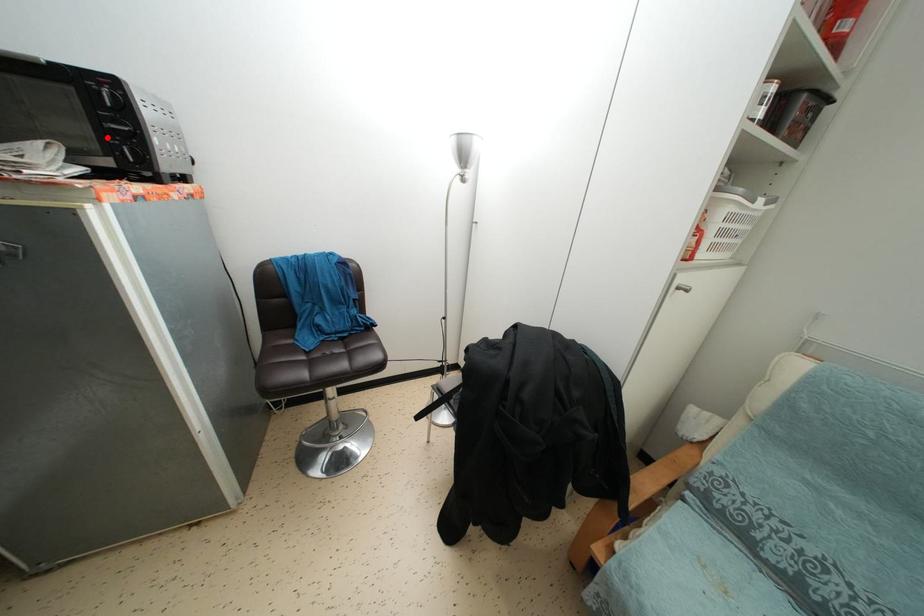
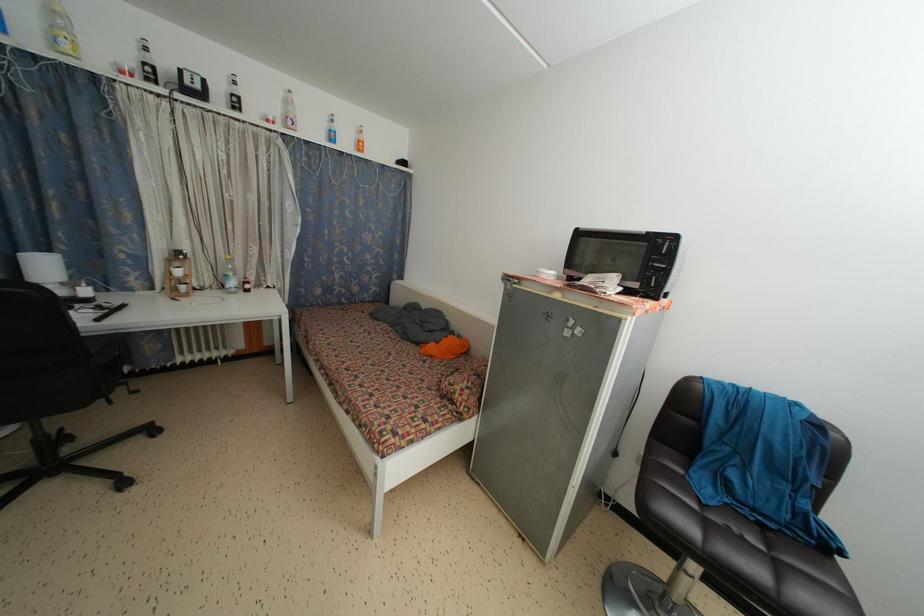
Find the pixel in the second image that matches the highlighted location in the first image.

(650, 273)